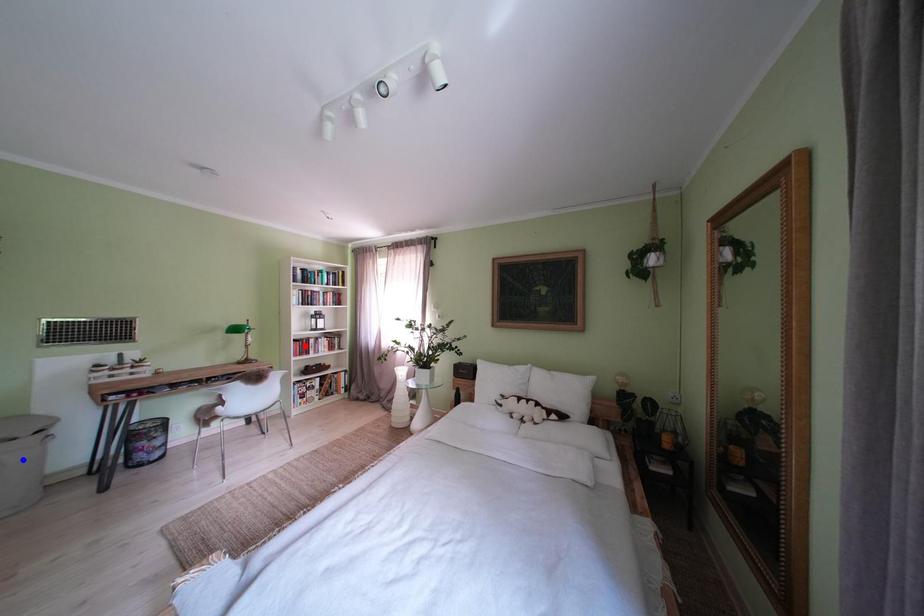
Question: Two points are marked on the image. Which point is closer to the camera?

Choices:
 (A) Blue point is closer.
 (B) Red point is closer.

Answer: (A)